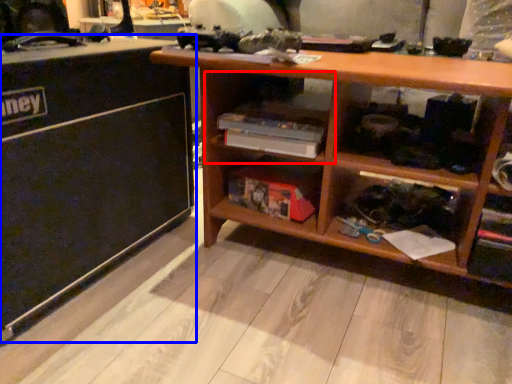
Question: Which point is further to the camera, cabinet (highlighted by a red box) or table (highlighted by a blue box)?

Choices:
 (A) cabinet
 (B) table

Answer: (A)